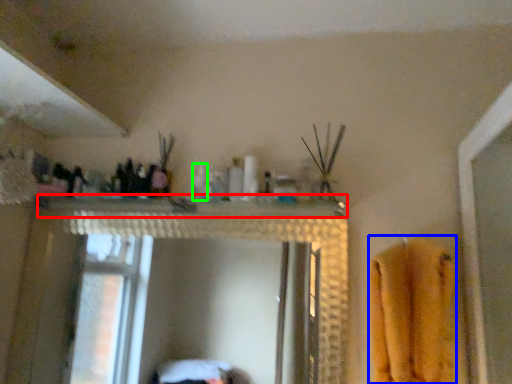
Question: Considering the real-world distances, which object is farthest from counter top (highlighted by a red box)? bath towel (highlighted by a blue box) or toiletry (highlighted by a green box)?

Choices:
 (A) bath towel
 (B) toiletry

Answer: (A)